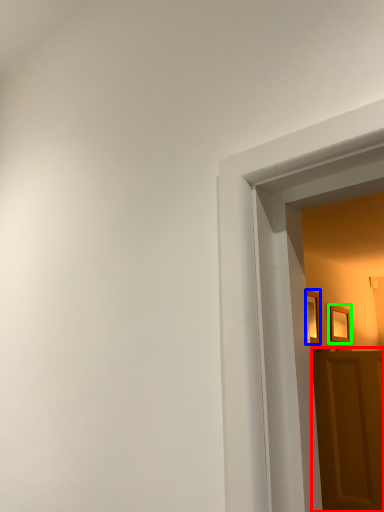
Question: Based on their relative distances, which object is nearer to door (highlighted by a red box)? Choose from picture frame (highlighted by a blue box) and picture frame (highlighted by a green box).

Choices:
 (A) picture frame
 (B) picture frame

Answer: (A)